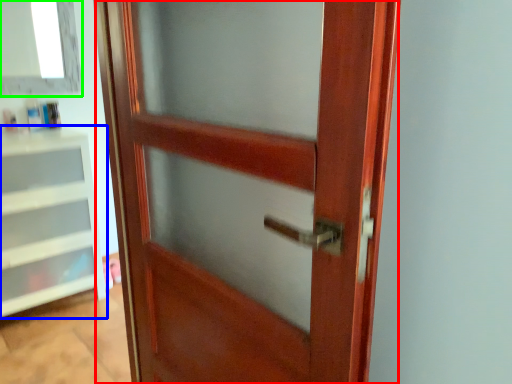
Question: Considering the real-world distances, which object is farthest from door (highlighted by a red box)? shelf (highlighted by a blue box) or window (highlighted by a green box)?

Choices:
 (A) shelf
 (B) window

Answer: (B)